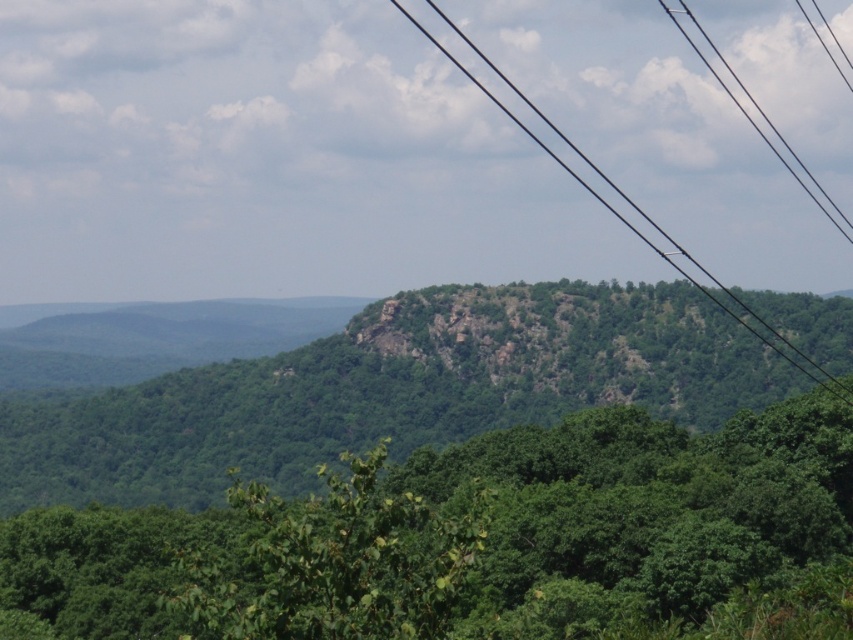
You are a hiker planning to take a photo of the green rocky mountain at center and the black wire at upper center. From your current position, which object is positioned lower in the frame?

The green rocky mountain at center is positioned below the black wire at upper center, so the green rocky mountain at center is lower in the frame.

You are a bird flying over the scenic landscape. You see two black wires in the sky. One is the black wire at upper center and the other is the black wire at upper right. Which black wire is positioned more to the left?

The black wire at upper center is positioned more to the left than the black wire at upper right.